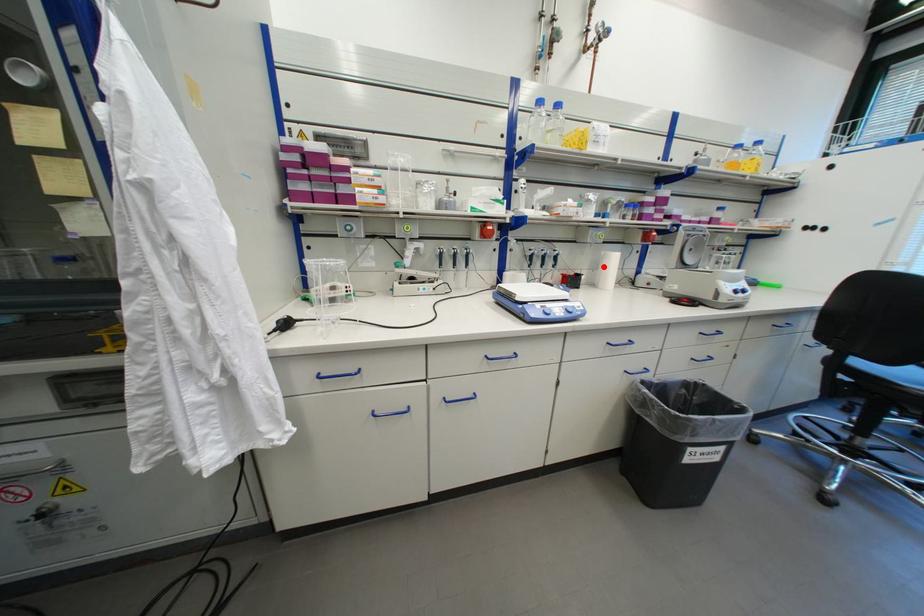
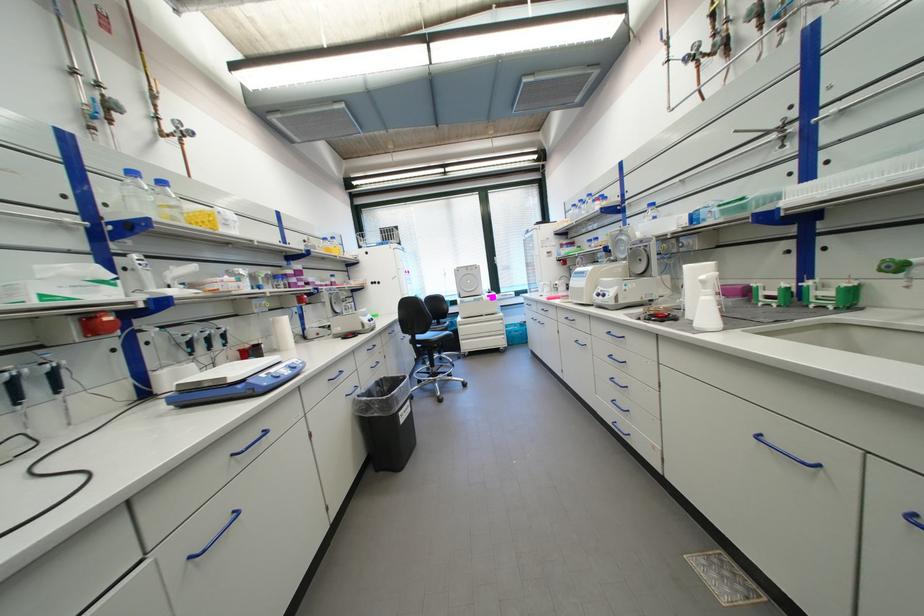
Find the pixel in the second image that matches the highlighted location in the first image.

(276, 334)